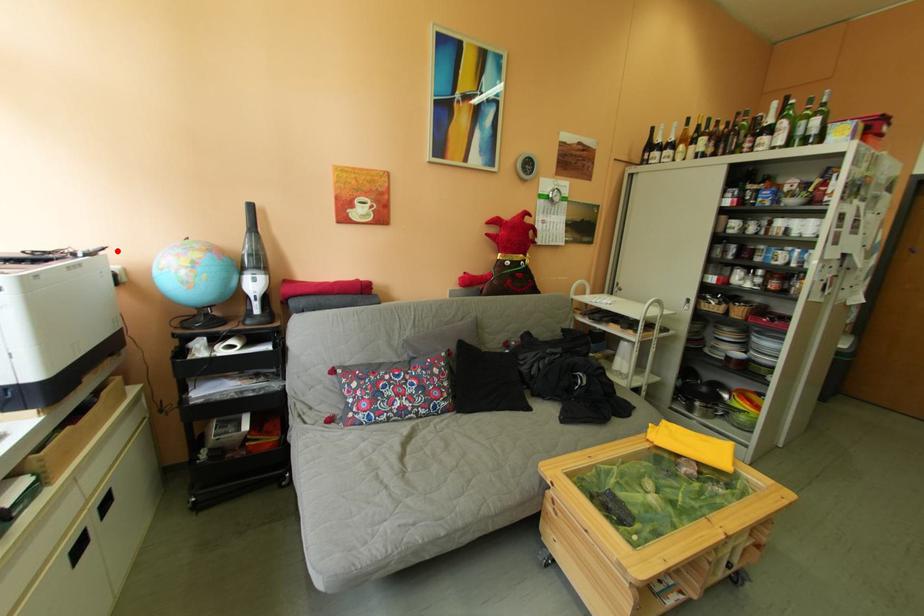
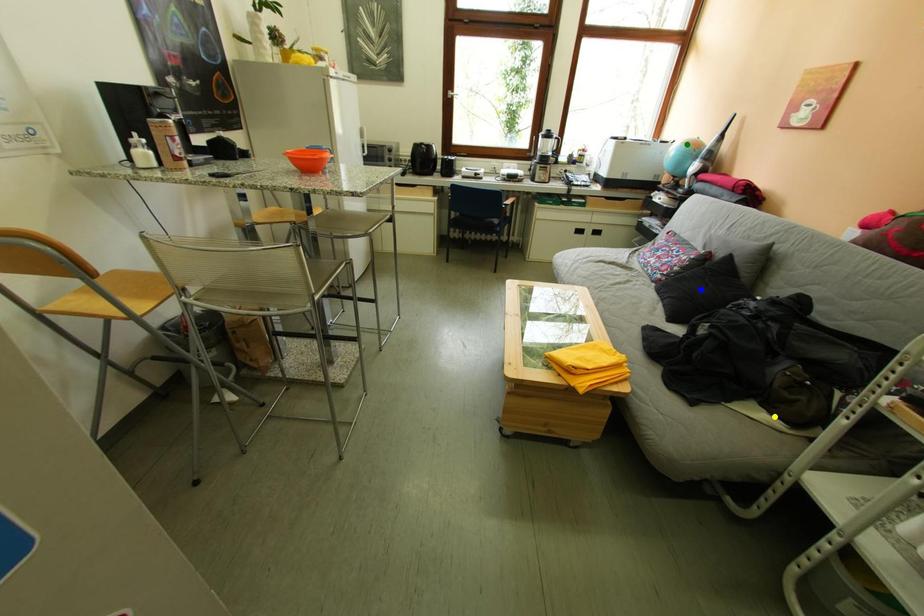
Question: I am providing you with two images of the same scene from different viewpoints. A red point is marked on the first image. You are given multiple points on the second image. Can you choose the point in image 2 that corresponds to the point in image 1?

Choices:
 (A) yellow point
 (B) blue point
 (C) green point

Answer: (C)